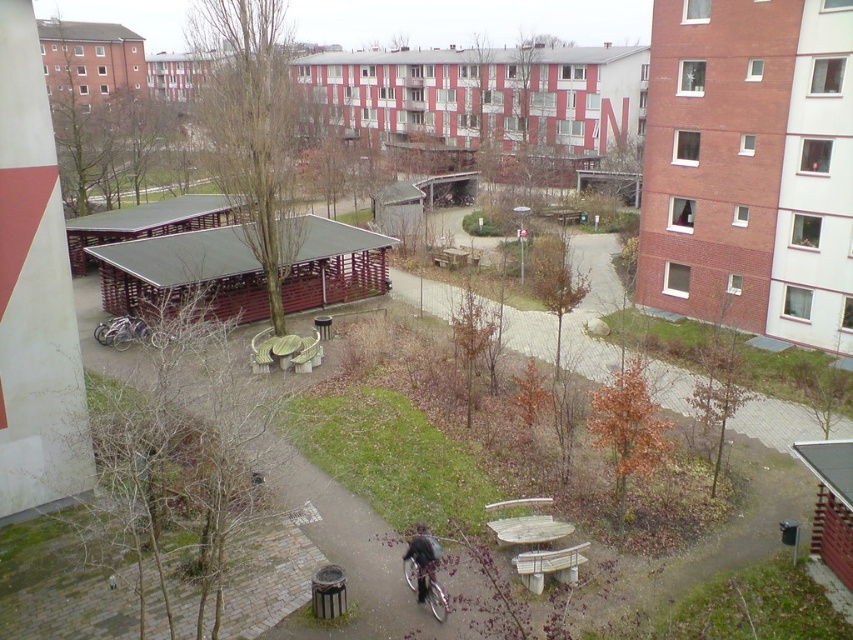
You are standing at the entrance of the courtyard and want to reach the brick paved path at center. According to the coordinates provided, in which direction should you walk from your current position?

The brick paved path at center is located at coordinates point (776,422). Since coordinates typically increase from the bottom left corner, you should walk towards the upper right direction to reach it.

You are standing at the point marked by the coordinate (x=538, y=548) in the courtyard. What object are you standing on?

You are standing on the wooden picnic table at center, as the point (x=538, y=548) represents its location.

You are standing at the edge of the courtyard and see the wooden picnic table at center and the dark gray fabric jacket at lower center. Which object is closer to the right side of the courtyard?

The wooden picnic table at center is closer to the right side of the courtyard because it is positioned to the right of the dark gray fabric jacket at lower center.